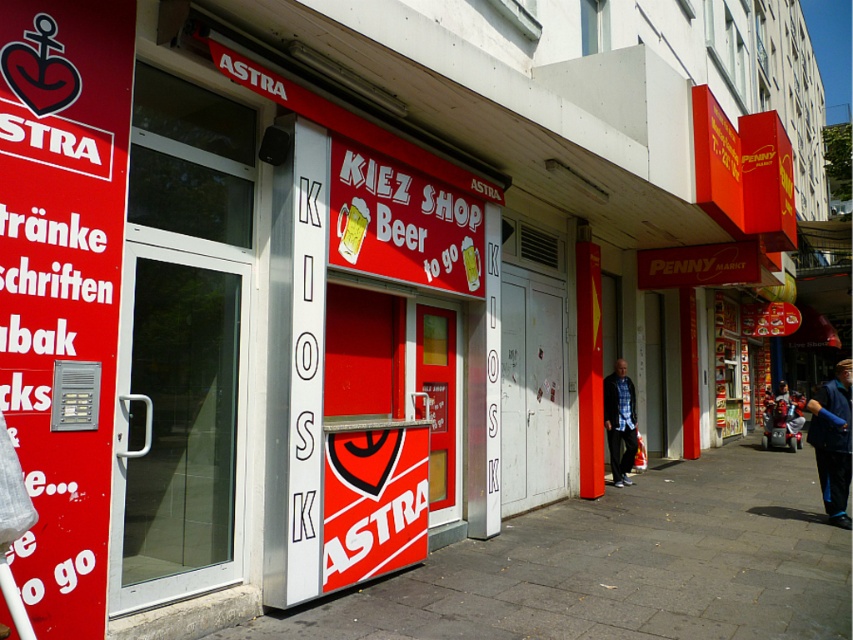
Question: Can you confirm if gray concrete pavement at center is bigger than blue denim jacket at lower right?

Choices:
 (A) no
 (B) yes

Answer: (B)

Question: Which of the following is the closest to the observer?

Choices:
 (A) (782, 410)
 (B) (65, 92)

Answer: (B)

Question: Can you confirm if matte red sign at left is positioned below blue plaid shirt at center?

Choices:
 (A) no
 (B) yes

Answer: (A)

Question: Estimate the real-world distances between objects in this image. Which object is closer to the blue plaid shirt at center?

Choices:
 (A) blue fabric jacket at lower right
 (B) gray concrete pavement at center
 (C) matte red sign at left

Answer: (B)

Question: Based on their relative distances, which object is nearer to the blue denim jacket at lower right?

Choices:
 (A) blue fabric jacket at lower right
 (B) matte red sign at left
 (C) blue plaid shirt at center
 (D) gray concrete pavement at center

Answer: (C)

Question: Does gray concrete pavement at center have a smaller size compared to blue plaid shirt at center?

Choices:
 (A) no
 (B) yes

Answer: (A)